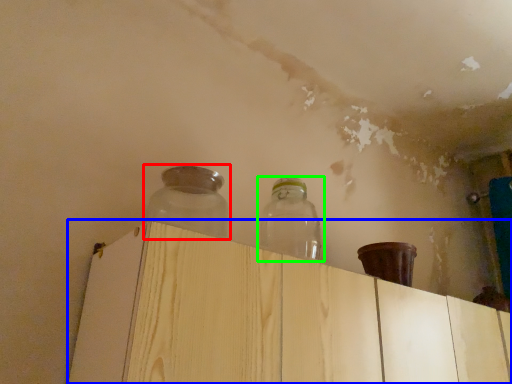
Question: Estimate the real-world distances between objects in this image. Which object is closer to bottle (highlighted by a red box), dresser (highlighted by a blue box) or bottle (highlighted by a green box)?

Choices:
 (A) dresser
 (B) bottle

Answer: (B)